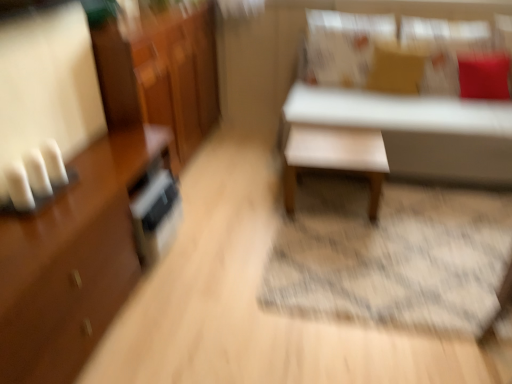
The image size is (512, 384). In order to click on vacant area that is in front of smooth beige table at center, the second table positioned from the right in this screenshot , I will do `click(347, 241)`.